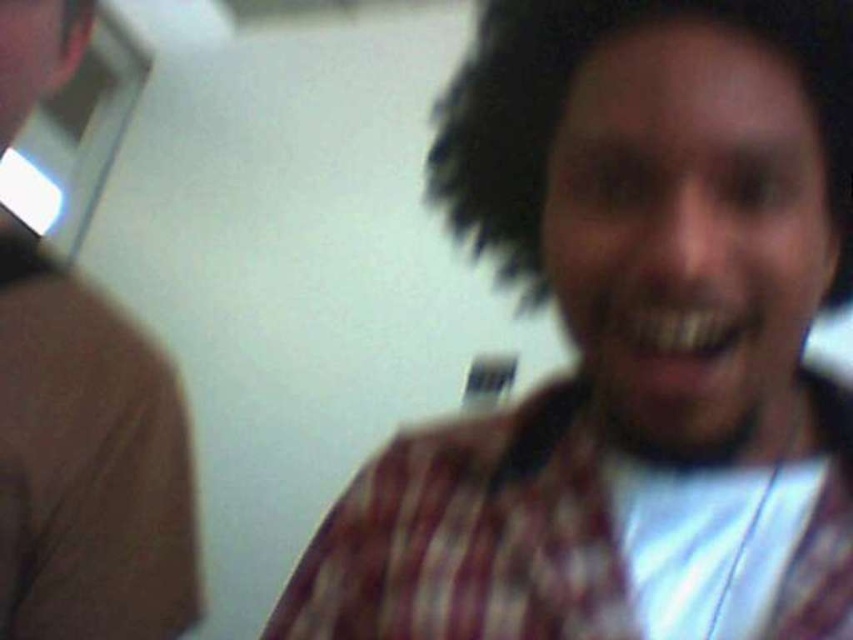
Who is higher up, brown wool sweater at left or dark curly hair at center?

dark curly hair at center is higher up.

Between brown wool sweater at left and dark curly hair at center, which one has more height?

brown wool sweater at left is taller.

The height and width of the screenshot is (640, 853). I want to click on brown wool sweater at left, so click(86, 465).

Does point (833, 504) come farther from viewer compared to point (141, 433)?

That is False.

The image size is (853, 640). Describe the element at coordinates (467, 538) in the screenshot. I see `plaid fabric at center` at that location.

Find the location of a particular element. plaid fabric at center is located at coordinates (x=467, y=538).

Which of these two, plaid shirt at center or dark curly hair at center, stands taller?

With more height is plaid shirt at center.

Which of these two, plaid shirt at center or dark curly hair at center, stands shorter?

With less height is dark curly hair at center.

Who is more distant from viewer, (432,456) or (521,257)?

Positioned behind is point (432,456).

Locate an element on the screen. plaid shirt at center is located at coordinates (630, 342).